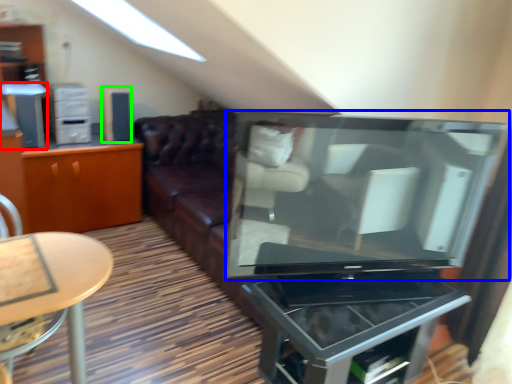
Question: Which object is positioned closest to appliance (highlighted by a red box)? Select from television (highlighted by a blue box) and appliance (highlighted by a green box).

Choices:
 (A) television
 (B) appliance

Answer: (B)